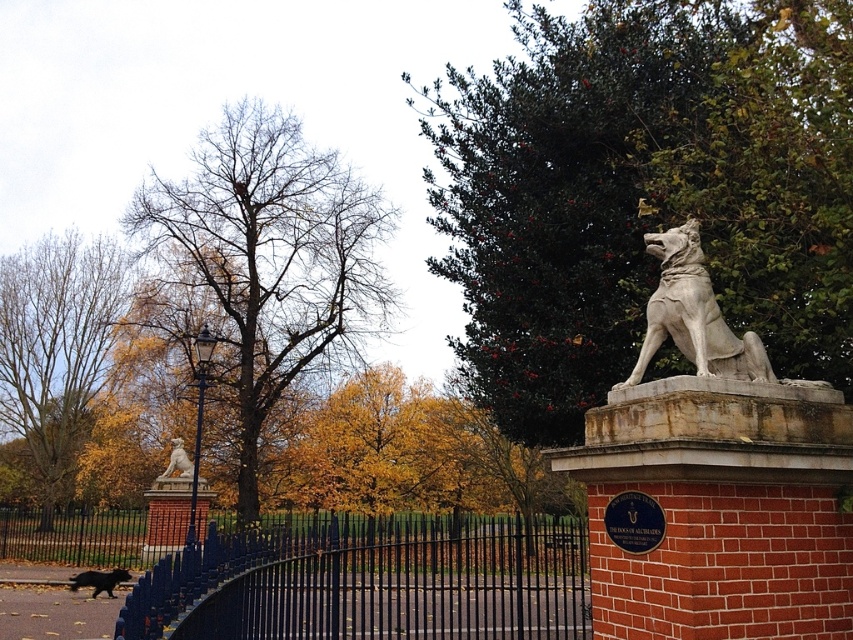
Does white stone dog at upper right have a lesser width compared to white marble lioness at lower left?

Yes, white stone dog at upper right is thinner than white marble lioness at lower left.

Is point (705, 282) in front of point (175, 458)?

Yes, it is.

Does point (674, 289) lie behind point (196, 486)?

No, (674, 289) is closer to viewer.

Identify the location of white stone dog at upper right. This screenshot has height=640, width=853. (693, 314).

Can you confirm if brown leafy tree at upper left is shorter than white marble lioness at lower left?

No, brown leafy tree at upper left is not shorter than white marble lioness at lower left.

Is brown leafy tree at upper left above white marble lioness at lower left?

Yes.

Is point (247, 296) positioned in front of point (165, 486)?

No, it is not.

Find the location of a particular element. This screenshot has width=853, height=640. brown leafy tree at upper left is located at coordinates (270, 259).

Between green leafy tree at upper right and white marble lioness at lower left, which one is positioned lower?

white marble lioness at lower left

Which is more to the left, green leafy tree at upper right or white marble lioness at lower left?

Positioned to the left is white marble lioness at lower left.

At what (x,y) coordinates should I click in order to perform the action: click on green leafy tree at upper right. Please return your answer as a coordinate pair (x, y). The image size is (853, 640). Looking at the image, I should click on (643, 193).